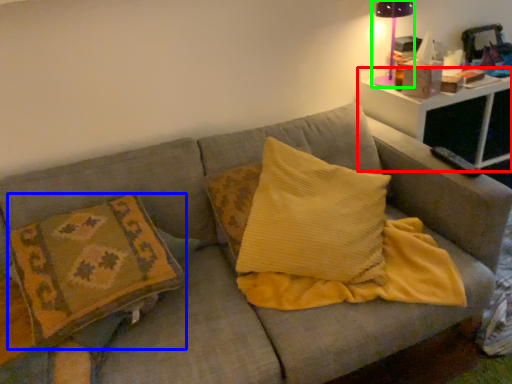
Question: Which object is positioned closest to table (highlighted by a red box)? Select from pillow (highlighted by a blue box) and table lamp (highlighted by a green box).

Choices:
 (A) pillow
 (B) table lamp

Answer: (B)